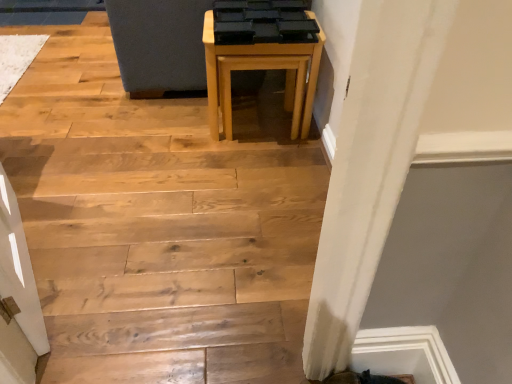
The height and width of the screenshot is (384, 512). What are the coordinates of `natural wood stairs at center` in the screenshot? It's located at (170, 255).

Describe the element at coordinates (170, 255) in the screenshot. I see `natural wood stairs at center` at that location.

The height and width of the screenshot is (384, 512). Identify the location of natural wood stairs at center. (170, 255).